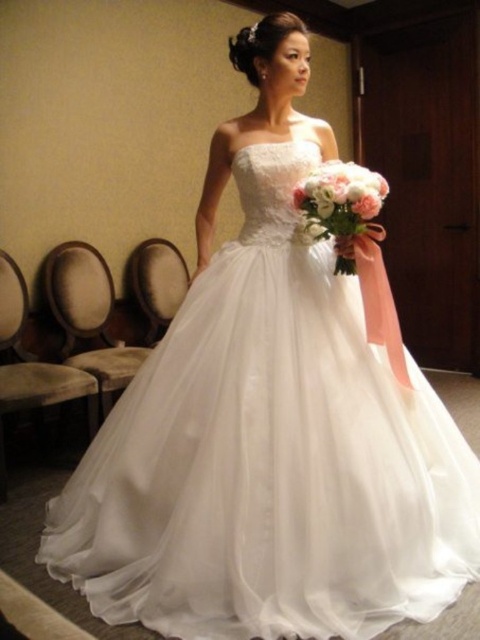
You are a photographer setting up for a wedding photo shoot. You need to ensure that both the white tulle dress at center and the white silk bouquet at center are visible in the frame. Given their sizes, which object should you focus on to ensure both are captured clearly?

The white tulle dress at center is larger than the white silk bouquet at center, so focusing on the dress will ensure both are visible in the frame.

Based on the scene description, where is the white tulle dress at center located in terms of its 2D coordinates?

The white tulle dress at center is located at the 2D coordinates of point (269, 456).

You are a photographer setting up for a wedding photoshoot. You need to position a lighting stand so that it doesn not block the subject. The white tulle dress at center and the white silk bouquet at center are both in the frame. Which object should you avoid placing the lighting stand in front of to ensure it doesn not obstruct the view of the taller object?

You should avoid placing the lighting stand in front of the white tulle dress at center because it is taller than the white silk bouquet at center and would be more likely to be obstructed if the stand is in front of it.